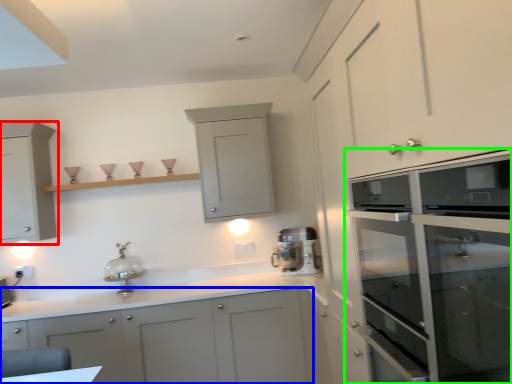
Question: Which object is the closest to the cabinetry (highlighted by a red box)? Choose among these: cabinetry (highlighted by a blue box) or cabinetry (highlighted by a green box).

Choices:
 (A) cabinetry
 (B) cabinetry

Answer: (A)